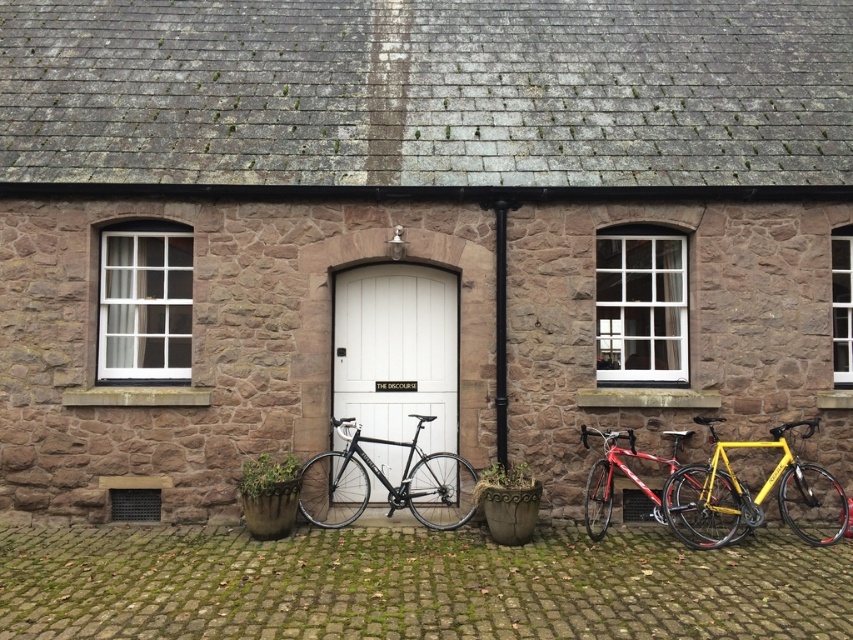
Question: Can you confirm if white matte door at center is positioned above yellow matte bicycle at right?

Choices:
 (A) yes
 (B) no

Answer: (A)

Question: Does white matte door at center have a lesser width compared to shiny red bicycle at center?

Choices:
 (A) yes
 (B) no

Answer: (A)

Question: Which of the following is the closest to the observer?

Choices:
 (A) (601, 508)
 (B) (430, 269)
 (C) (704, 529)
 (D) (332, 496)

Answer: (C)

Question: Based on their relative distances, which object is nearer to the white matte door at center?

Choices:
 (A) yellow matte bicycle at right
 (B) shiny black bike at center

Answer: (B)

Question: Among these objects, which one is farthest from the camera?

Choices:
 (A) shiny red bicycle at center
 (B) shiny black bike at center

Answer: (B)

Question: Does shiny black bike at center appear on the left side of shiny red bicycle at center?

Choices:
 (A) yes
 (B) no

Answer: (A)